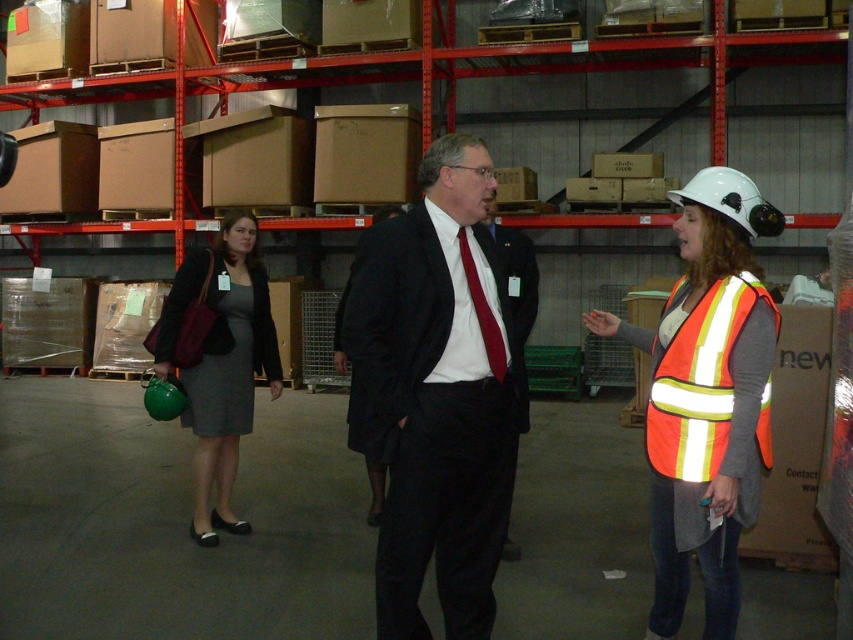
Consider the image. You are an employee in the warehouse and need to choose between the reflective orange safety vest at right and the red satin tie at center for a safety inspection. Which item is more appropriate to wear for visibility purposes?

The reflective orange safety vest at right is more appropriate to wear for visibility purposes because it is larger in size compared to the red satin tie at center, making it more visible in the warehouse environment.

You are an employee in the warehouse and need to locate the reflective orange safety vest at right and the red satin tie at center. Based on the scene description, which object is positioned lower in the image?

The reflective orange safety vest at right is positioned lower than the red satin tie at center according to the description.

Looking at this image, you are a warehouse worker who needs to take a photo of the reflective orange safety vest at center. Your camera is currently located at the position of the camera mentioned in the scene. Can you take the photo from there without moving the camera?

The reflective orange safety vest at center and camera are 8.64 feet apart from each other. Since the distance is sufficient for a clear photo, yes, you can take the photo from the camera location without moving it.